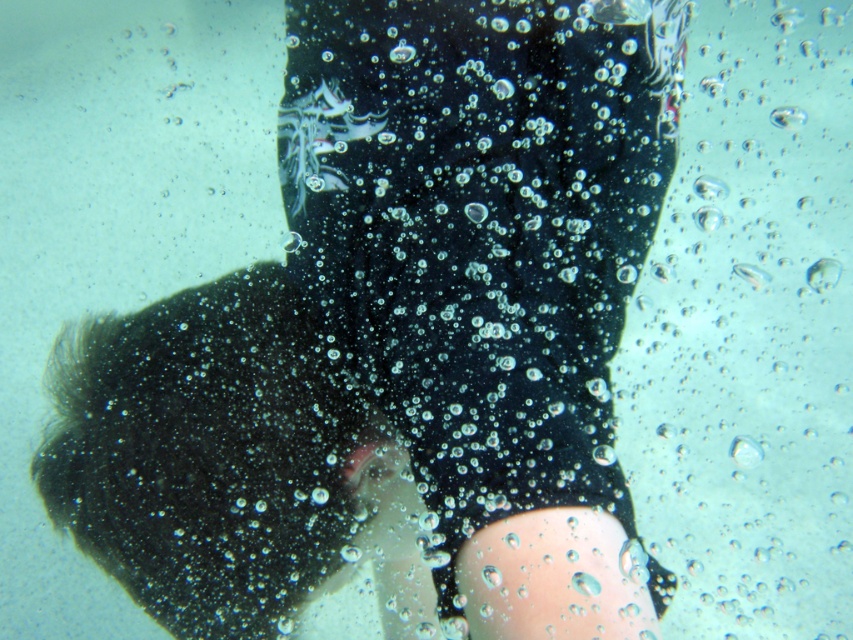
Question: Is black matte wetsuit at center below transparent bubbly water at upper center?

Choices:
 (A) no
 (B) yes

Answer: (B)

Question: Is transparent bubbly water at center thinner than transparent bubbly water at upper center?

Choices:
 (A) no
 (B) yes

Answer: (B)

Question: Which point appears farthest from the camera in this image?

Choices:
 (A) (785, 128)
 (B) (759, 449)
 (C) (541, 445)

Answer: (A)

Question: Which of the following is the farthest from the observer?

Choices:
 (A) (601, 634)
 (B) (733, 458)
 (C) (787, 109)

Answer: (C)

Question: Can you confirm if transparent bubbly water at center is smaller than transparent bubbly water at upper center?

Choices:
 (A) no
 (B) yes

Answer: (B)

Question: Which object appears farthest from the camera in this image?

Choices:
 (A) transparent bubbly water at center
 (B) black matte wetsuit at center

Answer: (A)